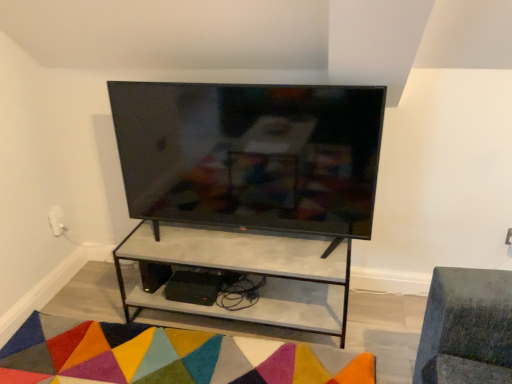
This screenshot has width=512, height=384. I want to click on matte concrete shelf at center, so click(246, 273).

Measure the distance between matte concrete shelf at center and camera.

matte concrete shelf at center is 1.77 meters from camera.

The image size is (512, 384). I want to click on matte black tv at center, so click(x=250, y=154).

Is point (216, 262) closer or farther from the camera than point (91, 328)?

Point (216, 262) is positioned closer to the camera compared to point (91, 328).

From a real-world perspective, is matte concrete shelf at center above or below multicolored felt mat at lower center?

In terms of real-world spatial position, matte concrete shelf at center is above multicolored felt mat at lower center.

Is matte concrete shelf at center touching multicolored felt mat at lower center?

No, matte concrete shelf at center is not making contact with multicolored felt mat at lower center.

Does matte concrete shelf at center lie behind multicolored felt mat at lower center?

That is True.

Between matte black tv at center and matte concrete shelf at center, which one has larger width?

matte concrete shelf at center.

Does matte black tv at center come behind matte concrete shelf at center?

No, it is not.

From a real-world perspective, is matte black tv at center physically located above or below matte concrete shelf at center?

matte black tv at center is situated higher than matte concrete shelf at center in the real world.

Does point (153, 370) appear closer or farther from the camera than point (290, 305)?

Clearly, point (153, 370) is closer to the camera than point (290, 305).

Identify the location of mat that is in front of the matte concrete shelf at center. This screenshot has height=384, width=512. tap(166, 357).

Based on the photo, is multicolored felt mat at lower center not inside matte concrete shelf at center?

Yes, multicolored felt mat at lower center is not within matte concrete shelf at center.

Is multicolored felt mat at lower center smaller than matte concrete shelf at center?

Yes, multicolored felt mat at lower center is smaller than matte concrete shelf at center.

Is multicolored felt mat at lower center next to matte black tv at center and touching it?

multicolored felt mat at lower center and matte black tv at center are not in contact.

How different are the orientations of multicolored felt mat at lower center and matte black tv at center in degrees?

multicolored felt mat at lower center and matte black tv at center are facing 0.984 degrees away from each other.

Who is bigger, multicolored felt mat at lower center or matte black tv at center?

matte black tv at center is bigger.

At what (x,y) coordinates should I click in order to perform the action: click on mat lying below the matte black tv at center (from the image's perspective). Please return your answer as a coordinate pair (x, y). Looking at the image, I should click on (166, 357).

At what (x,y) coordinates should I click in order to perform the action: click on shelf beneath the matte black tv at center (from a real-world perspective). Please return your answer as a coordinate pair (x, y). Looking at the image, I should click on (246, 273).

Does matte concrete shelf at center touch matte black tv at center?

There is a gap between matte concrete shelf at center and matte black tv at center.

From a real-world perspective, between matte concrete shelf at center and matte black tv at center, who is vertically lower?

In real-world perspective, matte concrete shelf at center is lower.

Can you confirm if matte black tv at center is thinner than multicolored felt mat at lower center?

Yes, matte black tv at center is thinner than multicolored felt mat at lower center.

Which is farther, (224, 165) or (164, 380)?

Positioned behind is point (224, 165).

Would you say matte black tv at center is to the left or to the right of multicolored felt mat at lower center in the picture?

In the image, matte black tv at center appears on the right side of multicolored felt mat at lower center.

Find the location of a particular element. television above the multicolored felt mat at lower center (from a real-world perspective) is located at coordinates (250, 154).

You are a GUI agent. You are given a task and a screenshot of the screen. Output one action in this format:
    pyautogui.click(x=<x>, y=<y>)
    Task: Click on the mat that is below the matte concrete shelf at center (from the image's perspective)
    
    Given the screenshot: What is the action you would take?
    pyautogui.click(x=166, y=357)

This screenshot has height=384, width=512. I want to click on television on the right of matte concrete shelf at center, so click(x=250, y=154).

Looking at the image, which one is located closer to multicolored felt mat at lower center, matte concrete shelf at center or matte black tv at center?

matte concrete shelf at center is closer to multicolored felt mat at lower center.

When comparing their distances from matte black tv at center, does matte concrete shelf at center or multicolored felt mat at lower center seem closer?

matte concrete shelf at center lies closer to matte black tv at center than the other object.

Estimate the real-world distances between objects in this image. Which object is further from matte black tv at center, multicolored felt mat at lower center or matte concrete shelf at center?

multicolored felt mat at lower center.

When comparing their distances from matte concrete shelf at center, does matte black tv at center or multicolored felt mat at lower center seem closer?

multicolored felt mat at lower center lies closer to matte concrete shelf at center than the other object.

Based on their spatial positions, is multicolored felt mat at lower center or matte black tv at center further from matte concrete shelf at center?

matte black tv at center lies further to matte concrete shelf at center than the other object.

Estimate the real-world distances between objects in this image. Which object is closer to multicolored felt mat at lower center, matte black tv at center or matte concrete shelf at center?

matte concrete shelf at center.

Image resolution: width=512 pixels, height=384 pixels. In order to click on shelf that lies between matte black tv at center and multicolored felt mat at lower center from top to bottom in this screenshot , I will do `click(246, 273)`.